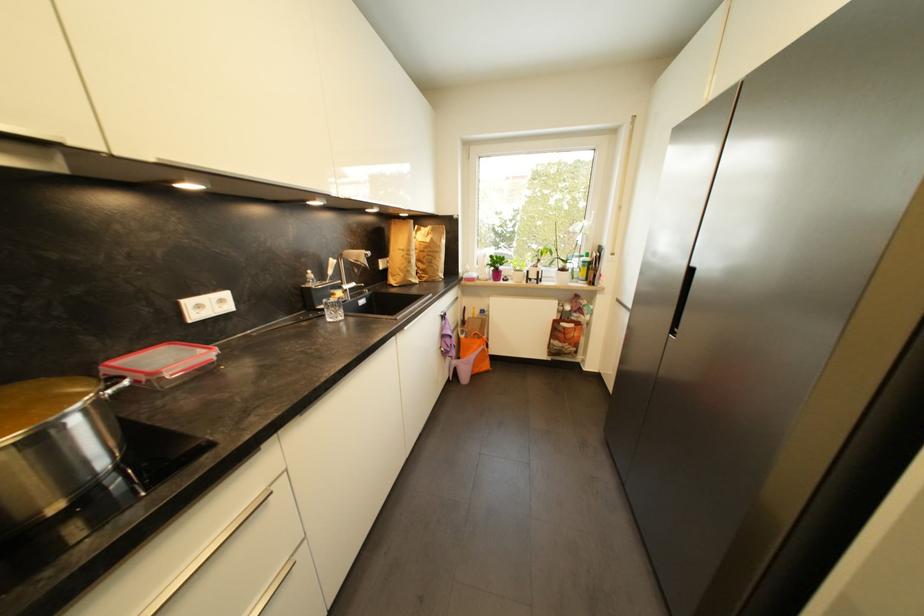
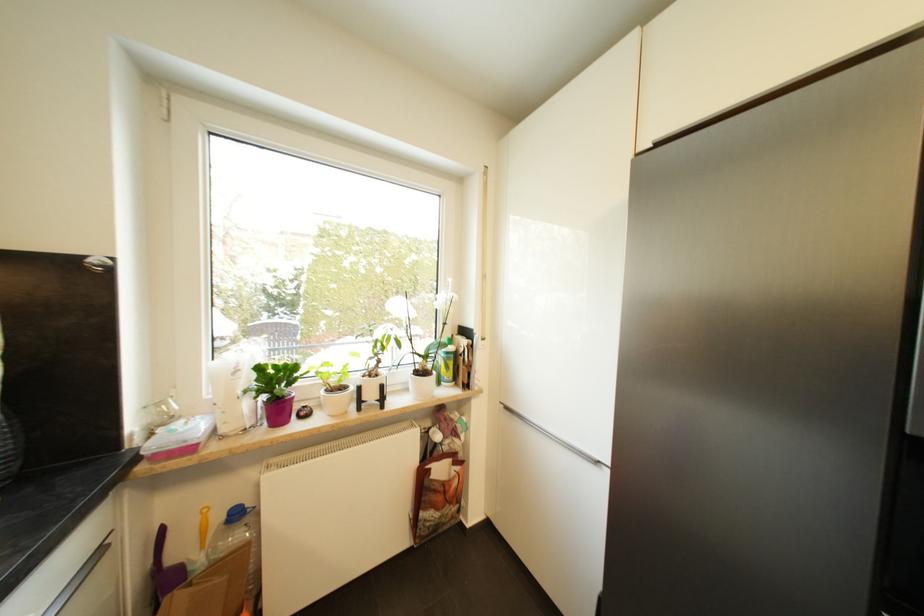
The point at [488,314] is marked in the first image. Where is the corresponding point in the second image?

(241, 517)